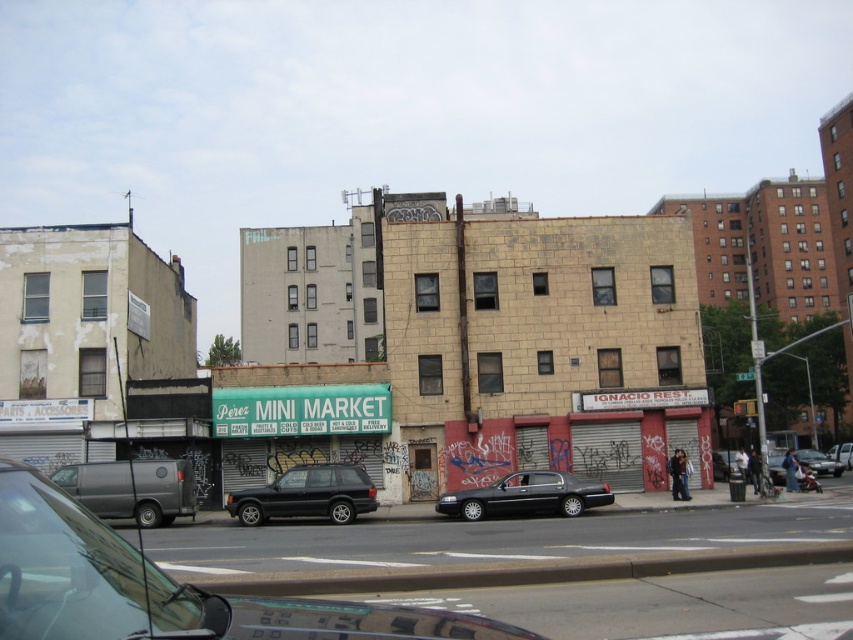
Question: Where is shiny black suv at center located in relation to silver metallic suv at center in the image?

Choices:
 (A) below
 (B) above

Answer: (B)

Question: Is shiny black suv at center to the left of silver metallic suv at center from the viewer's perspective?

Choices:
 (A) yes
 (B) no

Answer: (A)

Question: Can you confirm if black metallic sedan at center is bigger than silver metallic suv at center?

Choices:
 (A) yes
 (B) no

Answer: (B)

Question: Based on their relative distances, which object is farther from the black metallic sedan at center?

Choices:
 (A) shiny black suv at center
 (B) silver metallic suv at center

Answer: (B)

Question: Estimate the real-world distances between objects in this image. Which object is farther from the silver metallic suv at center?

Choices:
 (A) black matte suv at center
 (B) black metallic sedan at center

Answer: (B)

Question: Which is farther from the silver metallic suv at center?

Choices:
 (A) black metallic sedan at center
 (B) black matte suv at center
 (C) shiny black suv at center

Answer: (C)